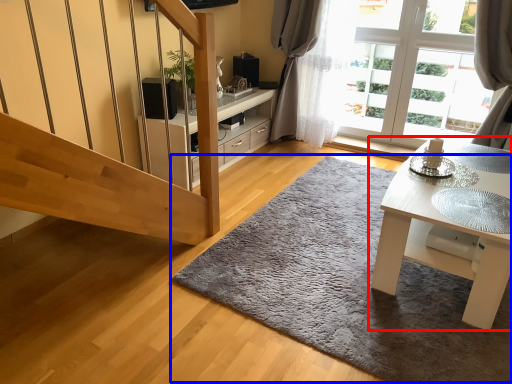
Question: Which point is closer to the camera, table (highlighted by a red box) or doormat (highlighted by a blue box)?

Choices:
 (A) table
 (B) doormat

Answer: (B)